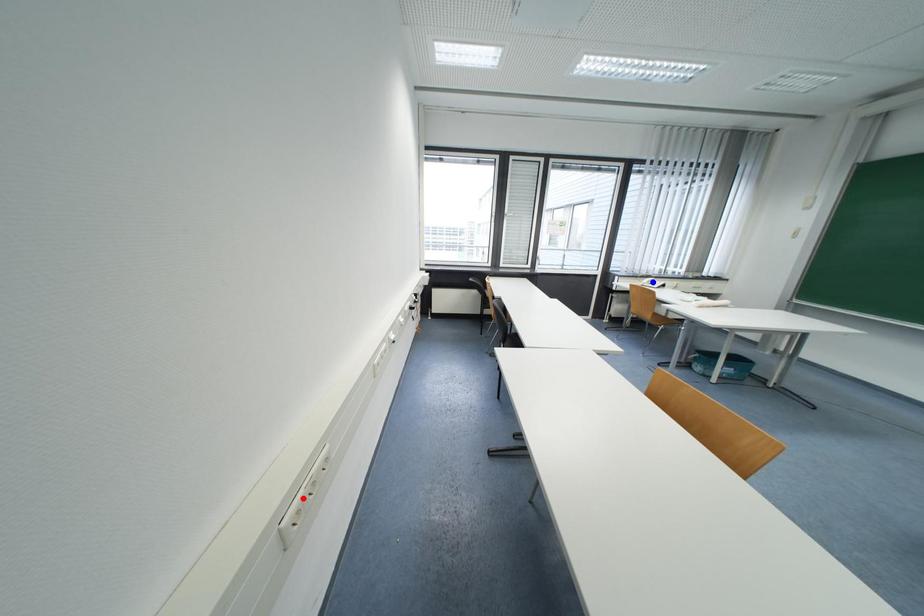
Question: Which of the two points in the image is closer to the camera?

Choices:
 (A) Blue point is closer.
 (B) Red point is closer.

Answer: (B)